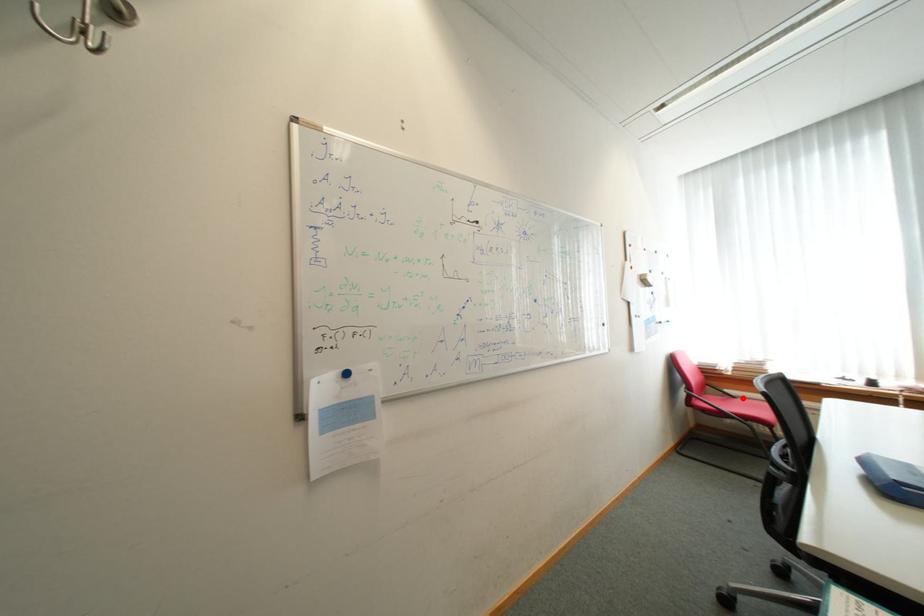
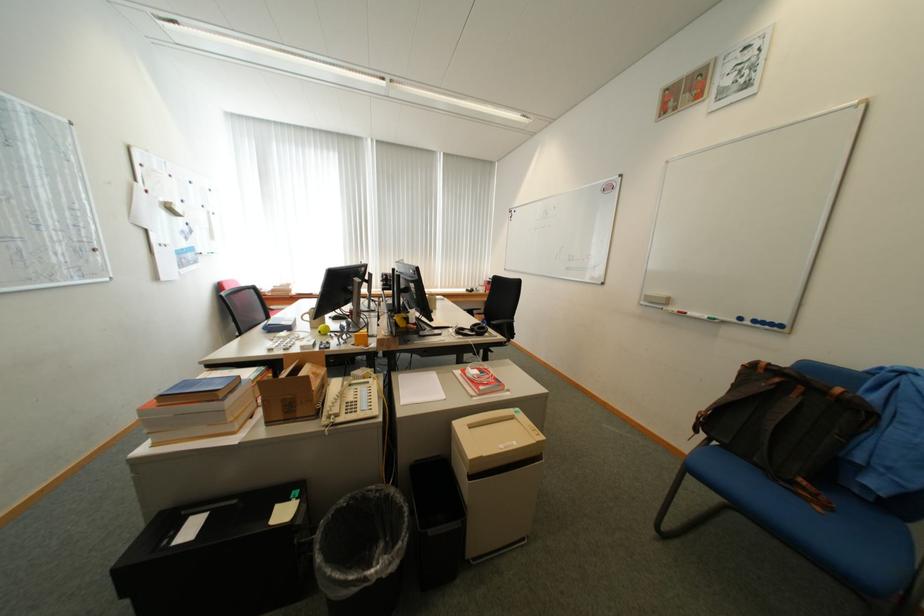
Question: I am providing you with two images of the same scene from different viewpoints. A red point is marked on the first image. At the location where the point appears in image 1, is it still visible in image 2?

Choices:
 (A) Yes
 (B) No

Answer: (B)